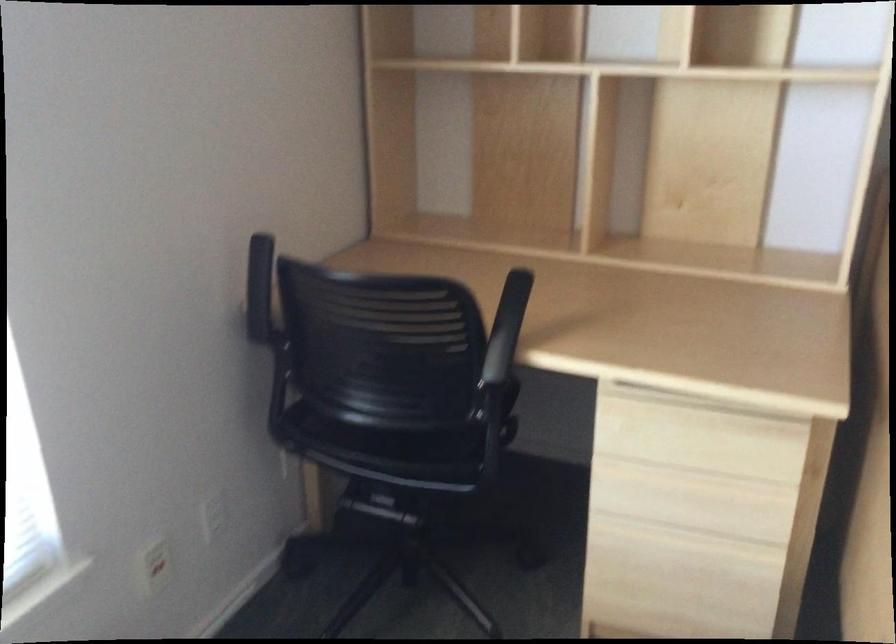
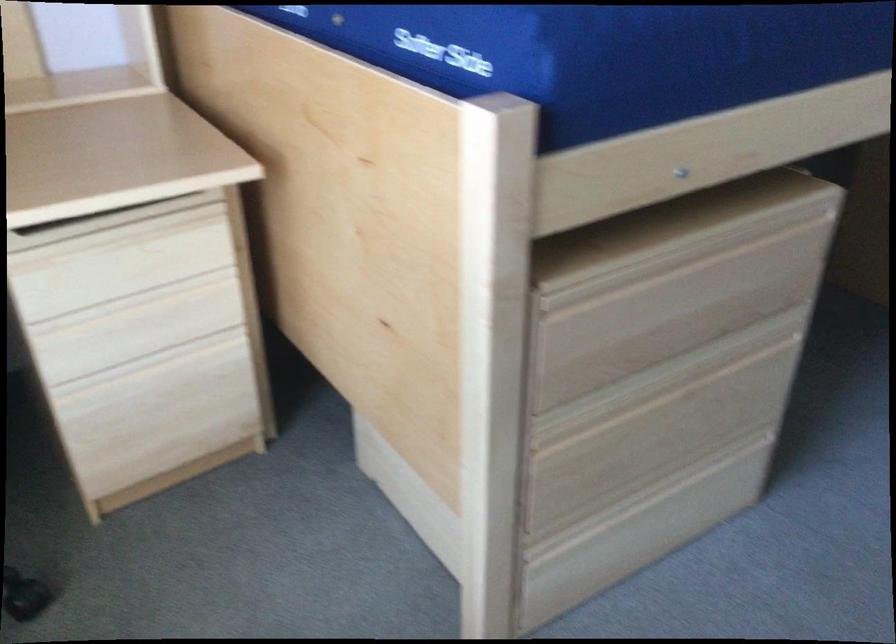
Locate, in the second image, the point that corresponds to pixel 685 474 in the first image.

(134, 301)